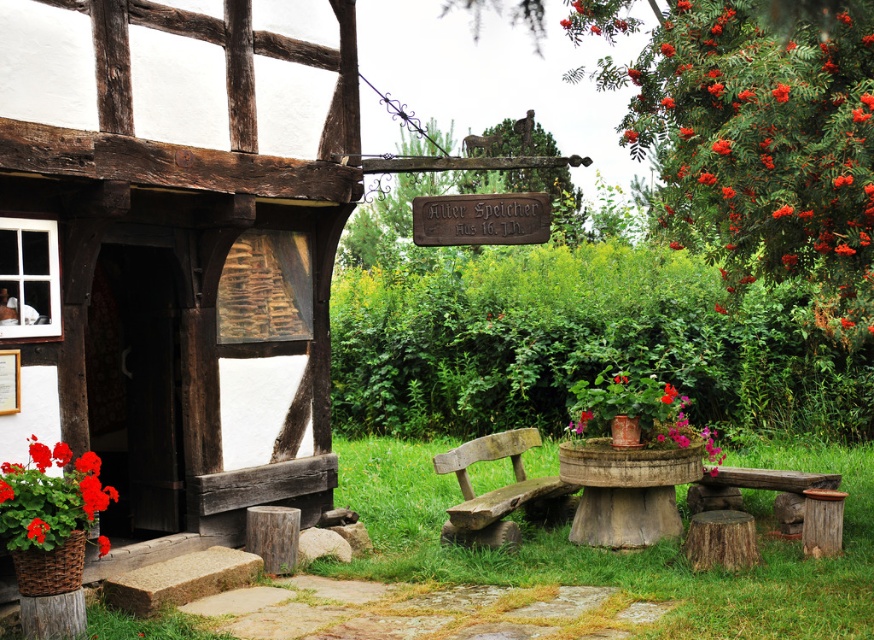
Question: Does red berries at upper right have a smaller size compared to red matte flower at center?

Choices:
 (A) yes
 (B) no

Answer: (B)

Question: Which object is positioned closest to the matte red flower at center?

Choices:
 (A) red matte flower at center
 (B) red matte flower at lower left
 (C) weathered wood bench at center

Answer: (B)

Question: Which of the following is the farthest from the observer?

Choices:
 (A) red berries at upper right
 (B) weathered wood bench at center
 (C) red matte flower at center
 (D) red matte flower at lower left

Answer: (B)

Question: Does red berries at upper right appear over weathered wood bench at center?

Choices:
 (A) no
 (B) yes

Answer: (B)

Question: Can you confirm if rustic wooden bench at lower right is positioned above red matte flower at lower left?

Choices:
 (A) no
 (B) yes

Answer: (A)

Question: Which of these objects is positioned farthest from the matte red flower at center?

Choices:
 (A) weathered wood bench at center
 (B) bright red geranium in woven basket at lower left
 (C) red matte flower at lower left

Answer: (A)